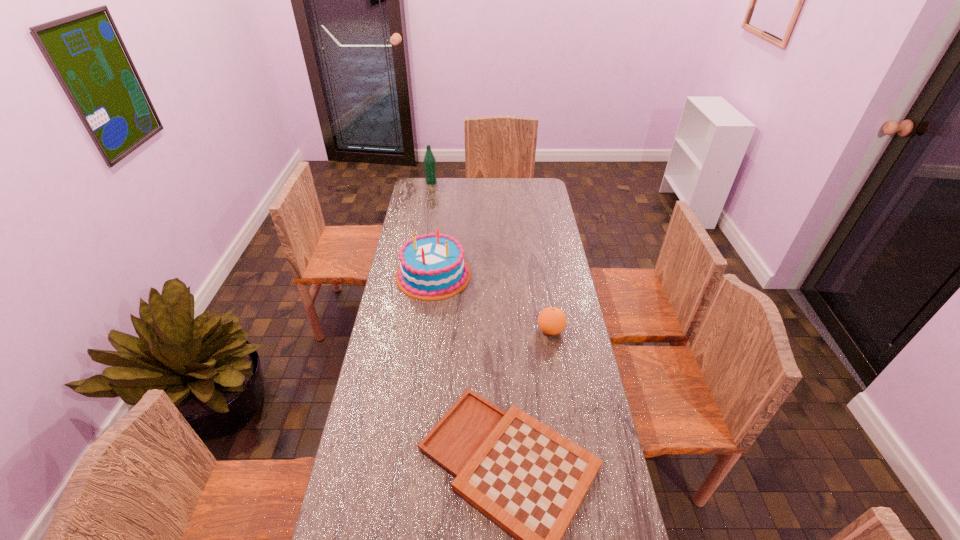
Where is `the farthest object`? The image size is (960, 540). the farthest object is located at coordinates (429, 160).

What are the coordinates of `birthday cake` in the screenshot? It's located at pos(431,267).

Where is `the third farthest object`? the third farthest object is located at coordinates (552, 321).

This screenshot has width=960, height=540. Identify the location of the third tallest object. (552, 321).

The image size is (960, 540). Identify the location of vacant region located 0.310m on the right of the bottle. (490, 182).

This screenshot has height=540, width=960. In order to click on vacant space located 0.230m on the right of the birthday cake in this screenshot , I will do `click(522, 275)`.

This screenshot has height=540, width=960. Identify the location of free space located on the front of the third tallest object. (x=558, y=373).

Identify the location of object situated at the far edge. This screenshot has height=540, width=960. (429, 160).

In order to click on bottle at the left edge in this screenshot , I will do `click(429, 160)`.

Where is `birthday cake at the left edge`? The height and width of the screenshot is (540, 960). birthday cake at the left edge is located at coordinates (431, 267).